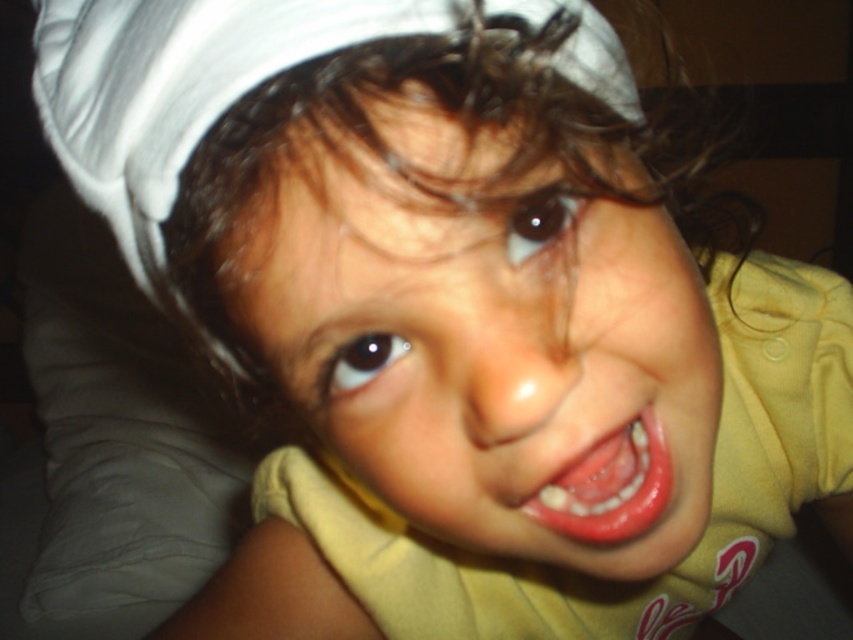
The child in the image has a smooth skin face at center and smooth pink lips at center. Which of these is positioned higher on the child?

The smooth skin face at center is located above the smooth pink lips at center.

Looking at the child in the image, which object is taller between the smooth skin face at center and the smooth pink lips at center?

The smooth skin face at center is taller than the smooth pink lips at center.

Looking at the image of the child, where is the smooth skin face at center in relation to the smooth pink lips at center?

The smooth skin face at center is to the left of the smooth pink lips at center.